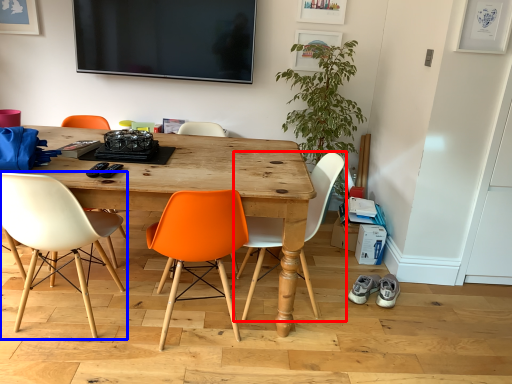
Question: Which object is further to the camera taking this photo, chair (highlighted by a red box) or chair (highlighted by a blue box)?

Choices:
 (A) chair
 (B) chair

Answer: (A)